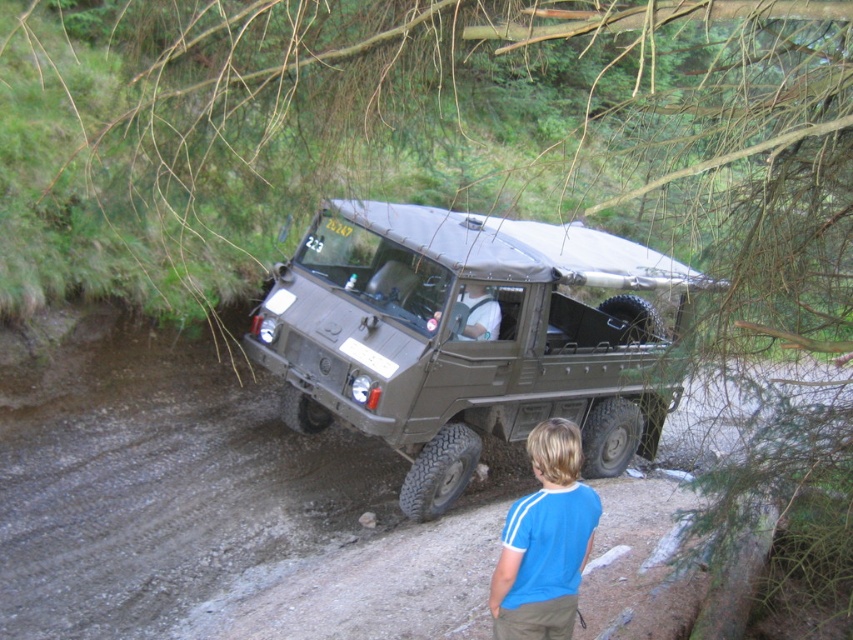
Question: Does matte green military vehicle at center come behind blue cotton shirt at lower center?

Choices:
 (A) no
 (B) yes

Answer: (B)

Question: Is the position of matte green military vehicle at center more distant than that of blue cotton shirt at lower center?

Choices:
 (A) no
 (B) yes

Answer: (B)

Question: Does matte green military vehicle at center have a lesser width compared to blue cotton shirt at lower center?

Choices:
 (A) no
 (B) yes

Answer: (A)

Question: Which point is farther from the camera taking this photo?

Choices:
 (A) (514, 506)
 (B) (621, 387)

Answer: (B)